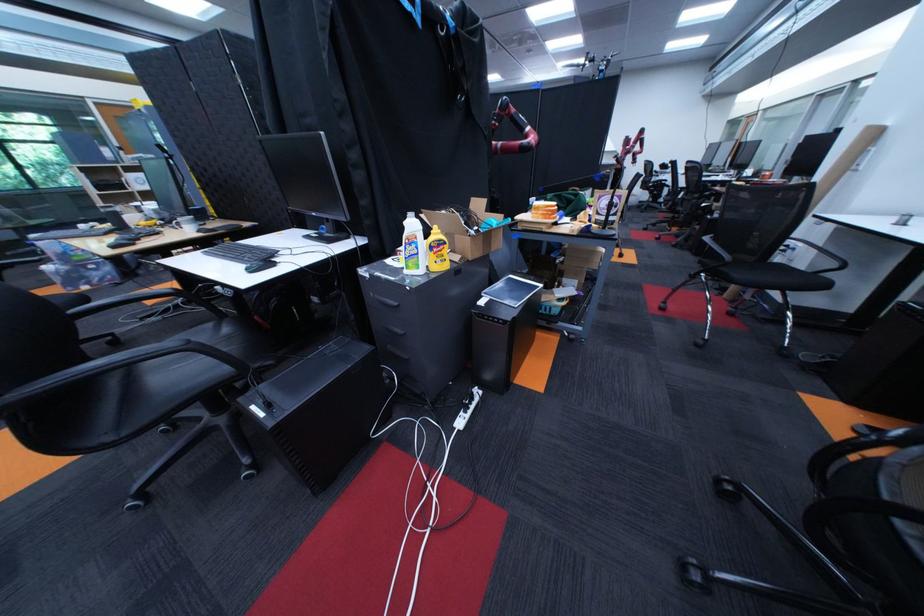
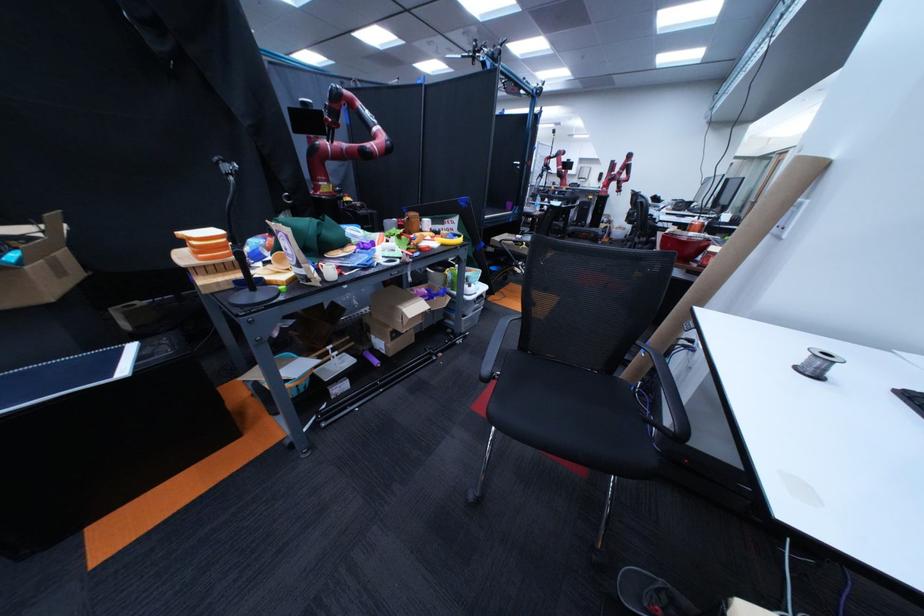
The images are taken continuously from a first-person perspective. In which direction are you moving?

The cameraman moved toward right, forward.